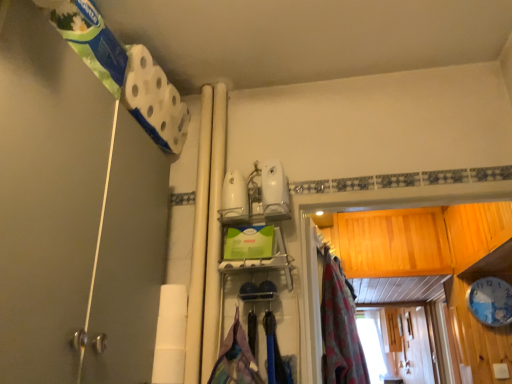
Find the location of a particular element. white matte toilet paper at lower left is located at coordinates (170, 335).

What is the approximate width of floral fabric curtain at center?

floral fabric curtain at center is 17.05 centimeters wide.

What do you see at coordinates (339, 329) in the screenshot? I see `floral fabric curtain at center` at bounding box center [339, 329].

This screenshot has width=512, height=384. Find the location of `white matte shower door at left`. white matte shower door at left is located at coordinates (46, 195).

From the image's perspective, is textured fabric laundry at center over floral fabric curtain at center?

No, from the image's perspective, textured fabric laundry at center is not over floral fabric curtain at center.

Considering the positions of points (260, 383) and (328, 372), is point (260, 383) closer to camera compared to point (328, 372)?

Yes, point (260, 383) is closer to viewer.

From a real-world perspective, between textured fabric laundry at center and floral fabric curtain at center, who is vertically higher?

From a 3D spatial view, floral fabric curtain at center is above.

From a real-world perspective, relative to white matte shower door at left, is textured fabric laundry at center vertically above or below?

textured fabric laundry at center is situated lower than white matte shower door at left in the real world.

Considering the relative sizes of textured fabric laundry at center and white matte shower door at left in the image provided, is textured fabric laundry at center smaller than white matte shower door at left?

Yes, textured fabric laundry at center is smaller than white matte shower door at left.

The width and height of the screenshot is (512, 384). I want to click on shower door above the textured fabric laundry at center (from the image's perspective), so click(46, 195).

Could you tell me if textured fabric laundry at center is facing white matte shower door at left?

No, textured fabric laundry at center is not facing towards white matte shower door at left.

Are white matte shower door at left and textured fabric laundry at center located far from each other?

white matte shower door at left is actually quite close to textured fabric laundry at center.

Does white matte shower door at left appear on the left side of textured fabric laundry at center?

Yes.

Which point is more forward, (116, 164) or (246, 358)?

The point (116, 164) is in front.

Which object is wider, white matte shower door at left or textured fabric laundry at center?

white matte shower door at left is wider.

Is floral fabric curtain at center at the right side of white matte shower door at left?

Correct, you'll find floral fabric curtain at center to the right of white matte shower door at left.

From a real-world perspective, is floral fabric curtain at center on white matte shower door at left?

Actually, floral fabric curtain at center is physically below white matte shower door at left in the real world.

You are a GUI agent. You are given a task and a screenshot of the screen. Output one action in this format:
    pyautogui.click(x=<x>, y=<y>)
    Task: Click on the shower door that appears above the floral fabric curtain at center (from the image's perspective)
    The height and width of the screenshot is (384, 512).
    Given the screenshot: What is the action you would take?
    pyautogui.click(x=46, y=195)

Is floral fabric curtain at center a part of white matte shower door at left?

That's incorrect, floral fabric curtain at center is not inside white matte shower door at left.

Identify the location of curtain below the white matte shower door at left (from the image's perspective). Image resolution: width=512 pixels, height=384 pixels. (339, 329).

In the image, is white matte shower door at left positioned in front of or behind floral fabric curtain at center?

Visually, white matte shower door at left is located in front of floral fabric curtain at center.

From the image's perspective, which is above, white matte shower door at left or floral fabric curtain at center?

white matte shower door at left.

Is floral fabric curtain at center not inside textured fabric laundry at center?

Yes.

From the image's perspective, is floral fabric curtain at center located above textured fabric laundry at center?

Correct, floral fabric curtain at center appears higher than textured fabric laundry at center in the image.

Is floral fabric curtain at center facing away from textured fabric laundry at center?

No, floral fabric curtain at center's orientation is not away from textured fabric laundry at center.

Would you consider floral fabric curtain at center to be distant from textured fabric laundry at center?

floral fabric curtain at center is actually quite close to textured fabric laundry at center.

Does floral fabric curtain at center have a lesser height compared to white matte toilet paper at lower left?

No, floral fabric curtain at center is not shorter than white matte toilet paper at lower left.

Which is closer, (362,361) or (178,293)?

Clearly, point (362,361) is more distant from the camera than point (178,293).

Is white matte toilet paper at lower left a part of floral fabric curtain at center?

That's incorrect, white matte toilet paper at lower left is not inside floral fabric curtain at center.

From a real-world perspective, is floral fabric curtain at center located higher than white matte toilet paper at lower left?

Yes, from a real-world perspective, floral fabric curtain at center is over white matte toilet paper at lower left

The width and height of the screenshot is (512, 384). In order to click on laundry that appears below the floral fabric curtain at center (from a real-world perspective) in this screenshot , I will do `click(236, 359)`.

In order to click on laundry lying behind the white matte shower door at left in this screenshot , I will do `click(236, 359)`.

Looking at the image, which one is located further to textured fabric laundry at center, floral fabric curtain at center or white matte toilet paper at lower left?

Among the two, floral fabric curtain at center is located further to textured fabric laundry at center.

Based on their spatial positions, is white matte toilet paper at lower left or floral fabric curtain at center further from textured fabric laundry at center?

floral fabric curtain at center lies further to textured fabric laundry at center than the other object.

Which object lies nearer to the anchor point white matte toilet paper at lower left, white matte shower door at left or textured fabric laundry at center?

textured fabric laundry at center.

Considering their positions, is textured fabric laundry at center positioned closer to white matte toilet paper at lower left than white matte shower door at left?

Based on the image, textured fabric laundry at center appears to be nearer to white matte toilet paper at lower left.

From the image, which object appears to be farther from white matte shower door at left, floral fabric curtain at center or textured fabric laundry at center?

Among the two, floral fabric curtain at center is located further to white matte shower door at left.

Based on their spatial positions, is white matte toilet paper at lower left or white matte shower door at left closer to floral fabric curtain at center?

The object closer to floral fabric curtain at center is white matte toilet paper at lower left.

Considering their positions, is floral fabric curtain at center positioned further to white matte toilet paper at lower left than textured fabric laundry at center?

floral fabric curtain at center is positioned further to the anchor white matte toilet paper at lower left.

Which object lies further to the anchor point floral fabric curtain at center, white matte toilet paper at lower left or textured fabric laundry at center?

white matte toilet paper at lower left.

Locate an element on the screen. This screenshot has height=384, width=512. laundry located between white matte shower door at left and white matte toilet paper at lower left in the depth direction is located at coordinates (236, 359).

Identify the location of laundry between white matte toilet paper at lower left and floral fabric curtain at center. (236, 359).

Where is `toilet paper between white matte shower door at left and floral fabric curtain at center in the front-back direction`? toilet paper between white matte shower door at left and floral fabric curtain at center in the front-back direction is located at coordinates (170, 335).

The height and width of the screenshot is (384, 512). Identify the location of laundry positioned between white matte shower door at left and floral fabric curtain at center from near to far. (236, 359).